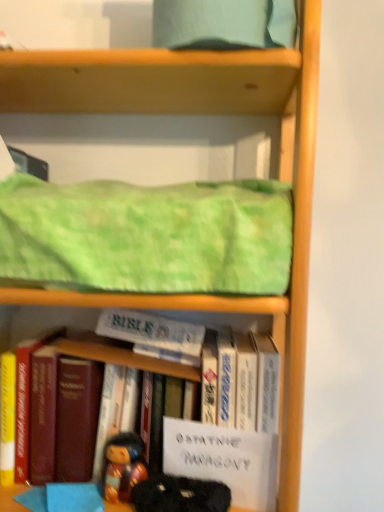
This screenshot has height=512, width=384. I want to click on white paper at center, the second paperback book from the bottom, so click(x=154, y=335).

The height and width of the screenshot is (512, 384). I want to click on white paper at center, which is counted as the 1th paperback book, starting from the bottom, so click(x=224, y=460).

Image resolution: width=384 pixels, height=512 pixels. Describe the element at coordinates (180, 495) in the screenshot. I see `velvet-like black doll at lower center` at that location.

Where is `hardcover book at center, which ranks as the 2th book in right-to-left order`? hardcover book at center, which ranks as the 2th book in right-to-left order is located at coordinates (80, 338).

Is hardcover book at center, which is counted as the 1th book, starting from the right, located within velvet-like black doll at lower center?

No.

Considering the sizes of velvet-like black doll at lower center and hardcover book at center, which is counted as the 1th book, starting from the right, in the image, is velvet-like black doll at lower center taller or shorter than hardcover book at center, which is counted as the 1th book, starting from the right,?

Clearly, velvet-like black doll at lower center is shorter compared to hardcover book at center, which is counted as the 1th book, starting from the right.

Is point (196, 484) closer or farther from the camera than point (223, 351)?

Point (196, 484) appears to be closer to the viewer than point (223, 351).

Is hardcover book at center, which ranks as the 2th book in right-to-left order, smaller than white paper at center, placed as the 1th paperback book when sorted from top to bottom?

No.

Between hardcover book at center, the first book in the left-to-right sequence, and white paper at center, marked as the first paperback book in a back-to-front arrangement, which one has more height?

Standing taller between the two is hardcover book at center, the first book in the left-to-right sequence.

Does hardcover book at center, which ranks as the 2th book in right-to-left order, have a lesser width compared to white paper at center, placed as the 1th paperback book when sorted from top to bottom?

No.

Does hardcover book at center, which ranks as the 2th book in right-to-left order, lie behind white paper at center, marked as the first paperback book in a back-to-front arrangement?

No, it is in front of white paper at center, marked as the first paperback book in a back-to-front arrangement.

Is wooden figurine at lower center inside or outside of white paper at center, the first paperback book in the front-to-back sequence?

wooden figurine at lower center is not inside white paper at center, the first paperback book in the front-to-back sequence, it's outside.

Is wooden figurine at lower center oriented away from white paper at center, which is counted as the 1th paperback book, starting from the bottom?

wooden figurine at lower center does not have its back to white paper at center, which is counted as the 1th paperback book, starting from the bottom.

In the image, is wooden figurine at lower center positioned in front of or behind white paper at center, the 2th paperback book positioned from the top?

wooden figurine at lower center is positioned farther from the viewer than white paper at center, the 2th paperback book positioned from the top.

From a real-world perspective, is velvet-like black doll at lower center beneath white paper at center, the 2th paperback book positioned from the top?

Yes, from a real-world perspective, velvet-like black doll at lower center is below white paper at center, the 2th paperback book positioned from the top.

Considering the relative positions of velvet-like black doll at lower center and white paper at center, which is counted as the 2th paperback book, starting from the back, in the image provided, is velvet-like black doll at lower center to the left of white paper at center, which is counted as the 2th paperback book, starting from the back, from the viewer's perspective?

Yes, velvet-like black doll at lower center is to the left of white paper at center, which is counted as the 2th paperback book, starting from the back.

In the scene shown: From the image's perspective, does velvet-like black doll at lower center appear higher than white paper at center, the first paperback book in the front-to-back sequence?

Actually, velvet-like black doll at lower center appears below white paper at center, the first paperback book in the front-to-back sequence, in the image.

Considering the positions of objects white paper at center, which is counted as the 2th paperback book, starting from the back, and green textured fabric at upper center in the image provided, who is more to the right, white paper at center, which is counted as the 2th paperback book, starting from the back, or green textured fabric at upper center?

white paper at center, which is counted as the 2th paperback book, starting from the back.

From the image's perspective, relative to green textured fabric at upper center, is white paper at center, the first paperback book in the front-to-back sequence, above or below?

white paper at center, the first paperback book in the front-to-back sequence, is below green textured fabric at upper center.

Where is `blanket on the left of white paper at center, the 2th paperback book positioned from the top`? The width and height of the screenshot is (384, 512). blanket on the left of white paper at center, the 2th paperback book positioned from the top is located at coordinates (148, 236).

Between velvet-like black doll at lower center and white paper at center, placed as the 1th paperback book when sorted from top to bottom, which one has smaller width?

velvet-like black doll at lower center.

Based on their sizes in the image, would you say velvet-like black doll at lower center is bigger or smaller than white paper at center, the second paperback book from the bottom?

In the image, velvet-like black doll at lower center appears to be smaller than white paper at center, the second paperback book from the bottom.

Would you consider velvet-like black doll at lower center to be distant from white paper at center, placed as the 1th paperback book when sorted from top to bottom?

No, velvet-like black doll at lower center is not far away from white paper at center, placed as the 1th paperback book when sorted from top to bottom.

Is velvet-like black doll at lower center to the left of white paper at center, the second paperback book when ordered from front to back, from the viewer's perspective?

No, velvet-like black doll at lower center is not to the left of white paper at center, the second paperback book when ordered from front to back.

Which object is closer to the camera, hardcover book at center, which is counted as the 1th book, starting from the right, or hardcover book at center, the first book in the left-to-right sequence?

hardcover book at center, the first book in the left-to-right sequence, is in front.

In the scene shown: Considering the sizes of objects hardcover book at center, which is counted as the 1th book, starting from the right, and hardcover book at center, the first book in the left-to-right sequence, in the image provided, who is shorter, hardcover book at center, which is counted as the 1th book, starting from the right, or hardcover book at center, the first book in the left-to-right sequence,?

Standing shorter between the two is hardcover book at center, which is counted as the 1th book, starting from the right.

Consider the image. Is hardcover book at center, marked as the second book in a left-to-right arrangement, beside hardcover book at center, the first book in the left-to-right sequence?

No.

From the image's perspective, is hardcover book at center, which is counted as the 1th book, starting from the right, on top of hardcover book at center, which ranks as the 2th book in right-to-left order?

Actually, hardcover book at center, which is counted as the 1th book, starting from the right, appears below hardcover book at center, which ranks as the 2th book in right-to-left order, in the image.

Where is `toy below the hardcover book at center, marked as the second book in a left-to-right arrangement (from the image's perspective)`? toy below the hardcover book at center, marked as the second book in a left-to-right arrangement (from the image's perspective) is located at coordinates (180, 495).

The width and height of the screenshot is (384, 512). I want to click on paperback book above the hardcover book at center, which ranks as the 2th book in right-to-left order (from a real-world perspective), so click(x=154, y=335).

From the image, which object appears to be farther from white paper at center, the 2th paperback book positioned from the top, white paper at center, the second paperback book from the bottom, or green textured fabric at upper center?

green textured fabric at upper center.

Looking at the image, which one is located further to hardcover book at center, the first book in the left-to-right sequence, hardcover book at center, marked as the second book in a left-to-right arrangement, or white paper at center, the first paperback book in the front-to-back sequence?

white paper at center, the first paperback book in the front-to-back sequence, is further to hardcover book at center, the first book in the left-to-right sequence.

Estimate the real-world distances between objects in this image. Which object is further from hardcover book at center, which is counted as the 1th book, starting from the right, white paper at center, placed as the 1th paperback book when sorted from top to bottom, or white paper at center, the 2th paperback book positioned from the top?

The object further to hardcover book at center, which is counted as the 1th book, starting from the right, is white paper at center, placed as the 1th paperback book when sorted from top to bottom.

From the image, which object appears to be nearer to white paper at center, the first paperback book in the front-to-back sequence, green textured fabric at upper center or wooden figurine at lower center?

The object closer to white paper at center, the first paperback book in the front-to-back sequence, is wooden figurine at lower center.

From the image, which object appears to be nearer to wooden figurine at lower center, white paper at center, the first paperback book in the front-to-back sequence, or green textured fabric at upper center?

Based on the image, white paper at center, the first paperback book in the front-to-back sequence, appears to be nearer to wooden figurine at lower center.

Based on their spatial positions, is white paper at center, the first paperback book in the front-to-back sequence, or white paper at center, the second paperback book when ordered from front to back, further from velvet-like black doll at lower center?

Based on the image, white paper at center, the second paperback book when ordered from front to back, appears to be further to velvet-like black doll at lower center.

Looking at the image, which one is located closer to white paper at center, marked as the first paperback book in a back-to-front arrangement, green textured fabric at upper center or velvet-like black doll at lower center?

green textured fabric at upper center is positioned closer to the anchor white paper at center, marked as the first paperback book in a back-to-front arrangement.

Considering their positions, is white paper at center, the 2th paperback book positioned from the top, positioned closer to hardcover book at center, the first book in the left-to-right sequence, than hardcover book at center, marked as the second book in a left-to-right arrangement?

hardcover book at center, marked as the second book in a left-to-right arrangement, is closer to hardcover book at center, the first book in the left-to-right sequence.

Find the location of `paperback book between green textured fabric at upper center and white paper at center, which is counted as the 2th paperback book, starting from the back, from top to bottom`. paperback book between green textured fabric at upper center and white paper at center, which is counted as the 2th paperback book, starting from the back, from top to bottom is located at coordinates (154, 335).

I want to click on toy situated between hardcover book at center, the first book in the left-to-right sequence, and hardcover book at center, marked as the second book in a left-to-right arrangement, from left to right, so click(x=180, y=495).

Identify the location of person located between hardcover book at center, the first book in the left-to-right sequence, and white paper at center, which is counted as the 1th paperback book, starting from the bottom, in the left-right direction. This screenshot has height=512, width=384. (123, 466).

The height and width of the screenshot is (512, 384). Find the location of `paperback book between green textured fabric at upper center and hardcover book at center, which ranks as the 2th book in right-to-left order, in the up-down direction`. paperback book between green textured fabric at upper center and hardcover book at center, which ranks as the 2th book in right-to-left order, in the up-down direction is located at coordinates (154, 335).